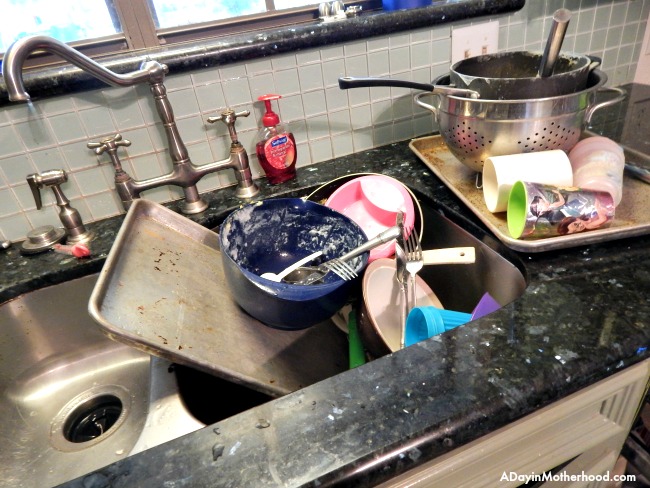
The width and height of the screenshot is (650, 488). Find the location of `silverware`. silverware is located at coordinates (407, 273), (320, 269).